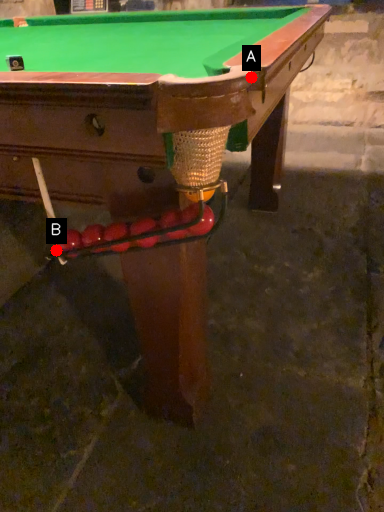
Question: Two points are circled on the image, labeled by A and B beside each circle. Which of the following is the farthest from the observer?

Choices:
 (A) A is further
 (B) B is further

Answer: (B)